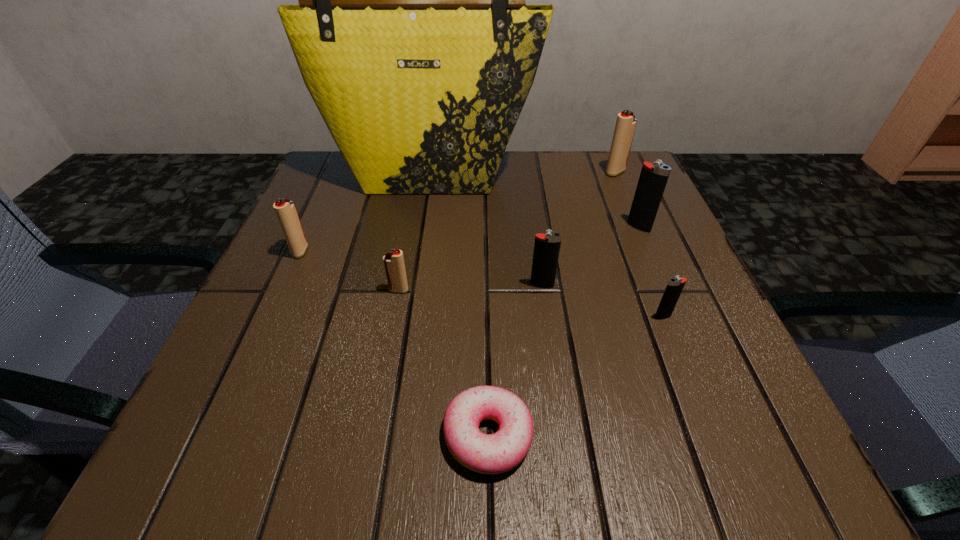
The width and height of the screenshot is (960, 540). Identify the location of free point located on the front of the fifth nearest object. (238, 392).

This screenshot has height=540, width=960. Identify the location of free region located on the front of the nearest red igniter. (370, 447).

The image size is (960, 540). In order to click on vacant region located 0.340m on the left of the second nearest object in this screenshot , I will do `click(445, 317)`.

Where is `vacant point located 0.050m on the back of the shortest object`? vacant point located 0.050m on the back of the shortest object is located at coordinates (487, 366).

Where is `tote bag that is at the far edge`? The image size is (960, 540). tote bag that is at the far edge is located at coordinates (412, 36).

At what (x,y) coordinates should I click in order to perform the action: click on igniter at the far edge. Please return your answer as a coordinate pair (x, y). The width and height of the screenshot is (960, 540). Looking at the image, I should click on (625, 127).

This screenshot has width=960, height=540. I want to click on object that is positioned at the near edge, so point(497,453).

Find the location of a particular element. Image resolution: width=960 pixels, height=540 pixels. tote bag that is at the left edge is located at coordinates (412, 36).

At what (x,y) coordinates should I click in order to perform the action: click on igniter that is at the left edge. Please return your answer as a coordinate pair (x, y). The height and width of the screenshot is (540, 960). Looking at the image, I should click on (285, 210).

This screenshot has height=540, width=960. Identify the location of object that is at the far left corner. 412,36.